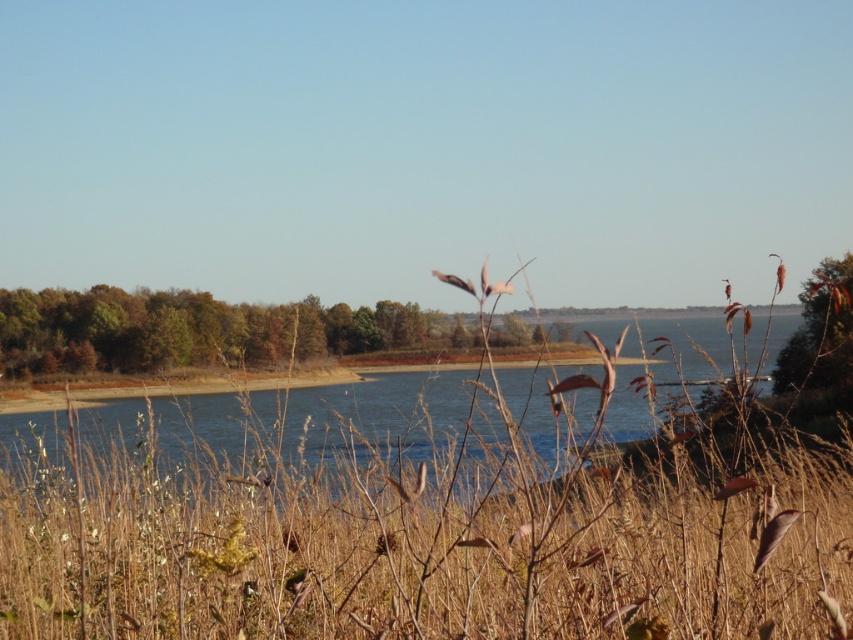
You are a photographer wanting to capture the brown dry grass at center and the brown matte branch at upper right in your shot. Which object appears shorter in the image?

The brown dry grass at center appears shorter than the brown matte branch at upper right.